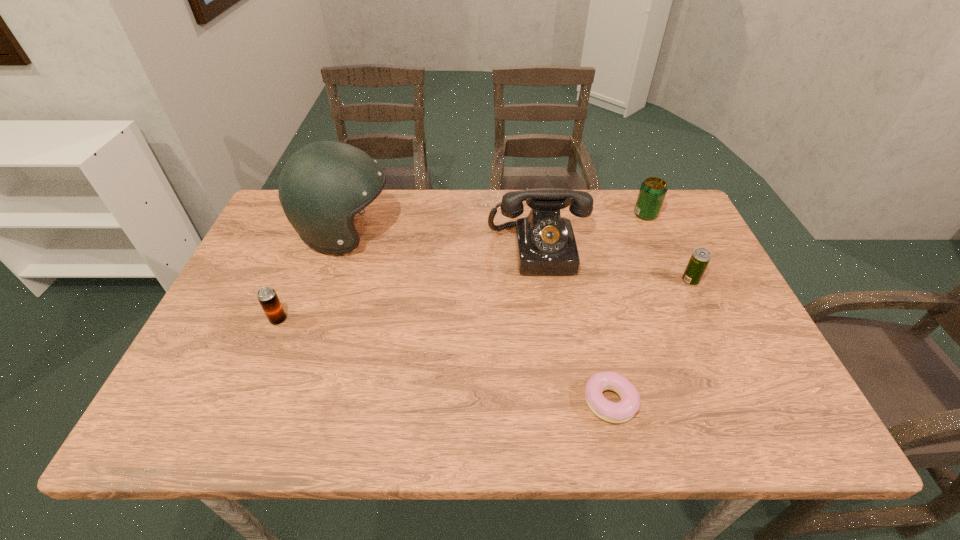
I want to click on the tallest object, so click(x=323, y=185).

This screenshot has height=540, width=960. In order to click on telephone in this screenshot , I will do `click(546, 245)`.

At what (x,y) coordinates should I click in order to perform the action: click on the farthest beer can. Please return your answer as a coordinate pair (x, y). This screenshot has width=960, height=540. Looking at the image, I should click on (653, 190).

Identify the location of the leftmost beer can. Image resolution: width=960 pixels, height=540 pixels. (x=267, y=296).

The width and height of the screenshot is (960, 540). Find the location of `the nearest beer can`. the nearest beer can is located at coordinates (267, 296).

Find the location of `the second nearest beer can`. the second nearest beer can is located at coordinates (699, 260).

I want to click on the nearest object, so click(x=615, y=412).

Locate an element on the screen. The width and height of the screenshot is (960, 540). doughnut is located at coordinates (615, 412).

Locate an element on the screen. This screenshot has height=540, width=960. free point located at the face opening of the tallest object is located at coordinates (499, 233).

The height and width of the screenshot is (540, 960). Identify the location of blank space located on the dial of the telephone. (552, 347).